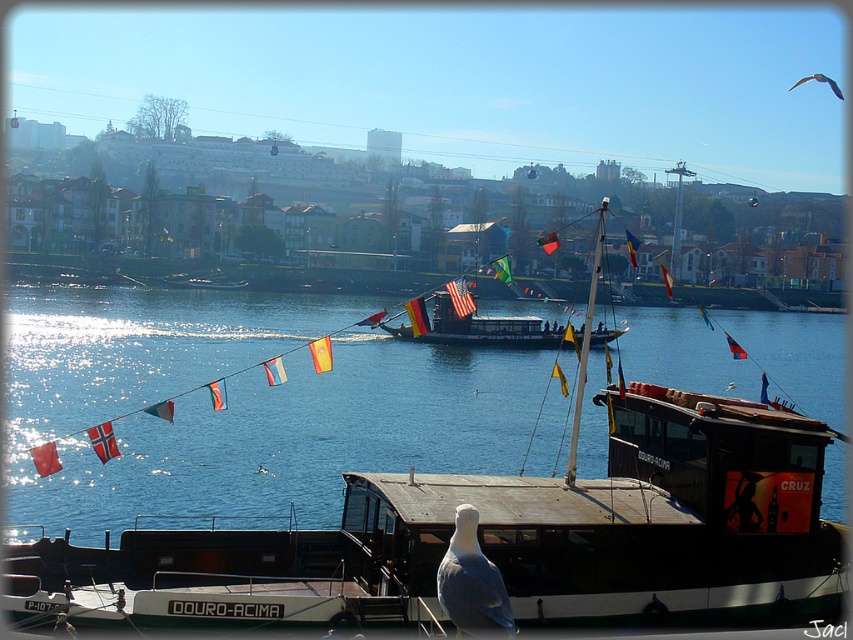
Between wooden sailboat at center and white feathered bird at center, which one is positioned higher?

wooden sailboat at center is higher up.

In the scene shown: Is wooden sailboat at center to the right of white feathered bird at center from the viewer's perspective?

Indeed, wooden sailboat at center is positioned on the right side of white feathered bird at center.

Is point (595, 269) positioned behind point (473, 545)?

Yes, point (595, 269) is farther from viewer.

The width and height of the screenshot is (853, 640). I want to click on wooden sailboat at center, so [x=502, y=326].

Between shiny black boat at center and gray feathered bird at upper right, which one appears on the left side from the viewer's perspective?

Positioned to the left is shiny black boat at center.

Is point (439, 307) less distant than point (819, 74)?

Yes, it is in front of point (819, 74).

Find the location of a particular element. The width and height of the screenshot is (853, 640). shiny black boat at center is located at coordinates (480, 328).

Which is behind, point (469, 557) or point (480, 324)?

Positioned behind is point (480, 324).

Who is more forward, (476, 573) or (502, 317)?

Positioned in front is point (476, 573).

What do you see at coordinates (471, 580) in the screenshot? The width and height of the screenshot is (853, 640). I see `white feathered bird at center` at bounding box center [471, 580].

The width and height of the screenshot is (853, 640). In order to click on white feathered bird at center in this screenshot , I will do `click(471, 580)`.